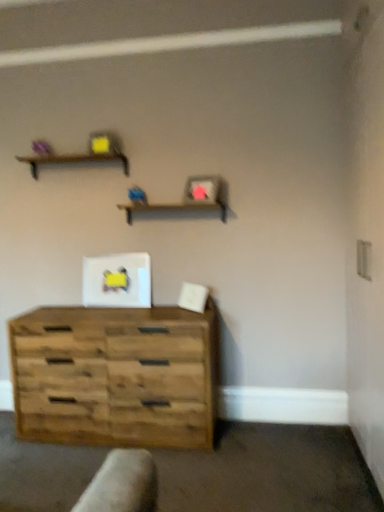
Question: Is rustic wood chest of drawers at lower left in front of brown wooden shelf at upper center, the 2th shelf ordered from the bottom?

Choices:
 (A) no
 (B) yes

Answer: (B)

Question: Is rustic wood chest of drawers at lower left outside brown wooden shelf at upper center, the 1th shelf in the top-to-bottom sequence?

Choices:
 (A) yes
 (B) no

Answer: (A)

Question: Is rustic wood chest of drawers at lower left positioned behind brown wooden shelf at upper center, the 1th shelf viewed from the left?

Choices:
 (A) yes
 (B) no

Answer: (B)

Question: Is rustic wood chest of drawers at lower left turned away from brown wooden shelf at upper center, the 1th shelf in the top-to-bottom sequence?

Choices:
 (A) yes
 (B) no

Answer: (B)

Question: Can you confirm if rustic wood chest of drawers at lower left is shorter than brown wooden shelf at upper center, the 1th shelf viewed from the left?

Choices:
 (A) yes
 (B) no

Answer: (B)

Question: Is rustic wood chest of drawers at lower left at the left side of brown wooden shelf at upper center, the 1th shelf in the top-to-bottom sequence?

Choices:
 (A) no
 (B) yes

Answer: (A)

Question: Is wooden shelf at center, which appears as the 2th shelf when viewed from the left, not inside brown wooden shelf at upper center, the 2th shelf ordered from the bottom?

Choices:
 (A) yes
 (B) no

Answer: (A)

Question: Is wooden shelf at center, which appears as the 2th shelf when viewed from the left, oriented away from brown wooden shelf at upper center, the 2th shelf from the right?

Choices:
 (A) yes
 (B) no

Answer: (B)

Question: Does wooden shelf at center, which is counted as the 1th shelf, starting from the right, have a lesser width compared to brown wooden shelf at upper center, the 2th shelf ordered from the bottom?

Choices:
 (A) no
 (B) yes

Answer: (A)

Question: Does wooden shelf at center, which is counted as the 1th shelf, starting from the bottom, have a lesser height compared to brown wooden shelf at upper center, the 2th shelf ordered from the bottom?

Choices:
 (A) no
 (B) yes

Answer: (A)

Question: Is wooden shelf at center, which is counted as the 1th shelf, starting from the right, positioned far away from brown wooden shelf at upper center, the 2th shelf from the right?

Choices:
 (A) no
 (B) yes

Answer: (A)

Question: Considering the relative positions of wooden shelf at center, which is counted as the 1th shelf, starting from the right, and brown wooden shelf at upper center, the 2th shelf from the right, in the image provided, is wooden shelf at center, which is counted as the 1th shelf, starting from the right, to the left of brown wooden shelf at upper center, the 2th shelf from the right, from the viewer's perspective?

Choices:
 (A) no
 (B) yes

Answer: (A)

Question: Considering the relative sizes of wooden shelf at center, which is counted as the 1th shelf, starting from the bottom, and rustic wood chest of drawers at lower left in the image provided, is wooden shelf at center, which is counted as the 1th shelf, starting from the bottom, shorter than rustic wood chest of drawers at lower left?

Choices:
 (A) no
 (B) yes

Answer: (B)